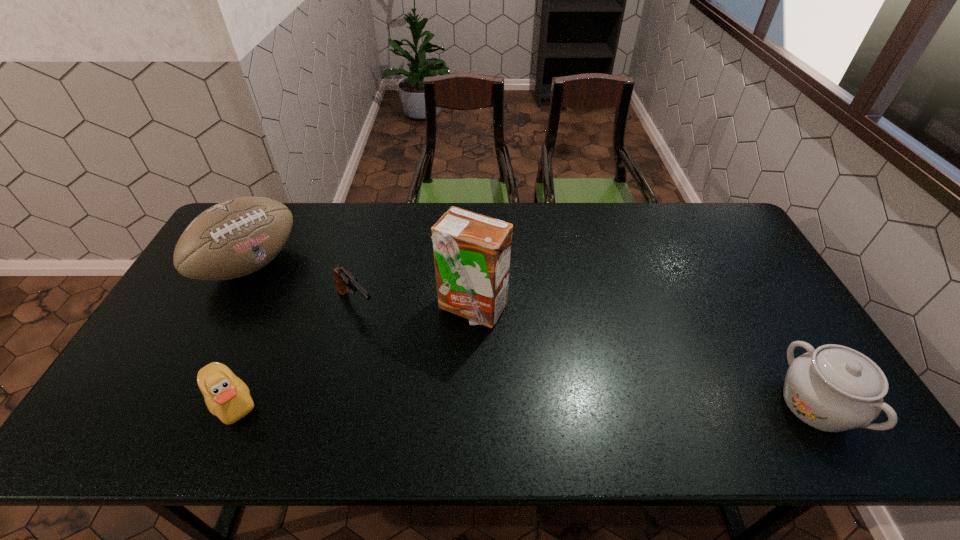
You are a GUI agent. You are given a task and a screenshot of the screen. Output one action in this format:
    pyautogui.click(x=<x>, y=<y>)
    Task: Click on the vacant space that's between the gun and the carton
    The height and width of the screenshot is (540, 960).
    Given the screenshot: What is the action you would take?
    pyautogui.click(x=414, y=306)

Locate an element on the screen. Image resolution: width=960 pixels, height=540 pixels. empty space that is in between the duck and the second tallest object is located at coordinates (241, 333).

This screenshot has height=540, width=960. I want to click on free spot between the rightmost object and the gun, so click(x=586, y=355).

Identify the location of free area in between the tallest object and the fourth shortest object. (361, 286).

Find the location of a particular element. free spot between the fourth shortest object and the carton is located at coordinates (361, 286).

Image resolution: width=960 pixels, height=540 pixels. I want to click on vacant area that lies between the second tallest object and the gun, so tap(303, 285).

This screenshot has width=960, height=540. What are the coordinates of `free spot between the duck and the rightmost object` in the screenshot? It's located at (523, 403).

Where is `empty space between the duck and the third object from left to right`? empty space between the duck and the third object from left to right is located at coordinates (294, 353).

Identify which object is located as the nearest to the third tallest object. Please provide its 2D coordinates. Your answer should be formatted as a tuple, i.e. [(x, y)], where the tuple contains the x and y coordinates of a point satisfying the conditions above.

[(472, 252)]

At what (x,y) coordinates should I click in order to perform the action: click on object that is the second closest one to the third tallest object. Please return your answer as a coordinate pair (x, y). The image size is (960, 540). Looking at the image, I should click on (343, 278).